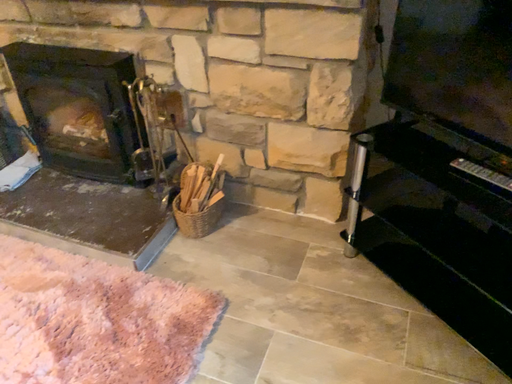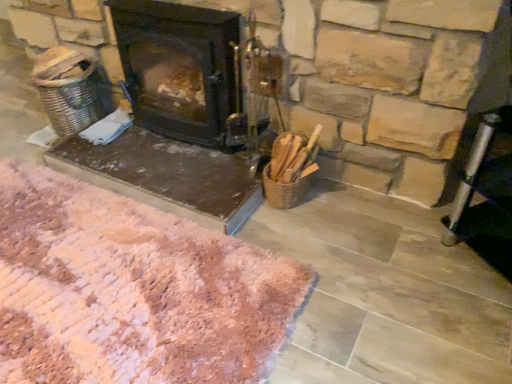
Question: How did the camera likely rotate when shooting the video?

Choices:
 (A) rotated right
 (B) rotated left

Answer: (B)